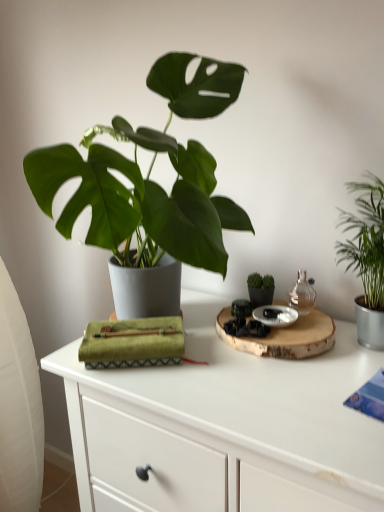
Question: From the image's perspective, would you say matte black pot at center is shown under transparent glass bottle at upper right?

Choices:
 (A) no
 (B) yes

Answer: (B)

Question: Is matte black pot at center looking in the opposite direction of transparent glass bottle at upper right?

Choices:
 (A) no
 (B) yes

Answer: (A)

Question: Does matte black pot at center have a larger size compared to transparent glass bottle at upper right?

Choices:
 (A) no
 (B) yes

Answer: (A)

Question: Is matte black pot at center closer to camera compared to transparent glass bottle at upper right?

Choices:
 (A) no
 (B) yes

Answer: (A)

Question: From the image's perspective, is matte black pot at center on transparent glass bottle at upper right?

Choices:
 (A) no
 (B) yes

Answer: (A)

Question: Considering the relative sizes of matte black pot at center and transparent glass bottle at upper right in the image provided, is matte black pot at center smaller than transparent glass bottle at upper right?

Choices:
 (A) yes
 (B) no

Answer: (A)

Question: From a real-world perspective, is green leafy plant at right positioned under white matte table at center based on gravity?

Choices:
 (A) yes
 (B) no

Answer: (B)

Question: Considering the relative sizes of green leafy plant at right and white matte table at center in the image provided, is green leafy plant at right smaller than white matte table at center?

Choices:
 (A) no
 (B) yes

Answer: (B)

Question: From the image's perspective, is green leafy plant at right on white matte table at center?

Choices:
 (A) yes
 (B) no

Answer: (A)

Question: From the image's perspective, would you say green leafy plant at right is shown under white matte table at center?

Choices:
 (A) no
 (B) yes

Answer: (A)

Question: Is green leafy plant at right not within white matte table at center?

Choices:
 (A) yes
 (B) no

Answer: (A)

Question: Can you confirm if green leafy plant at right is positioned to the right of white matte table at center?

Choices:
 (A) no
 (B) yes

Answer: (B)

Question: Does white matte table at center come in front of green leafy plant at right?

Choices:
 (A) no
 (B) yes

Answer: (B)